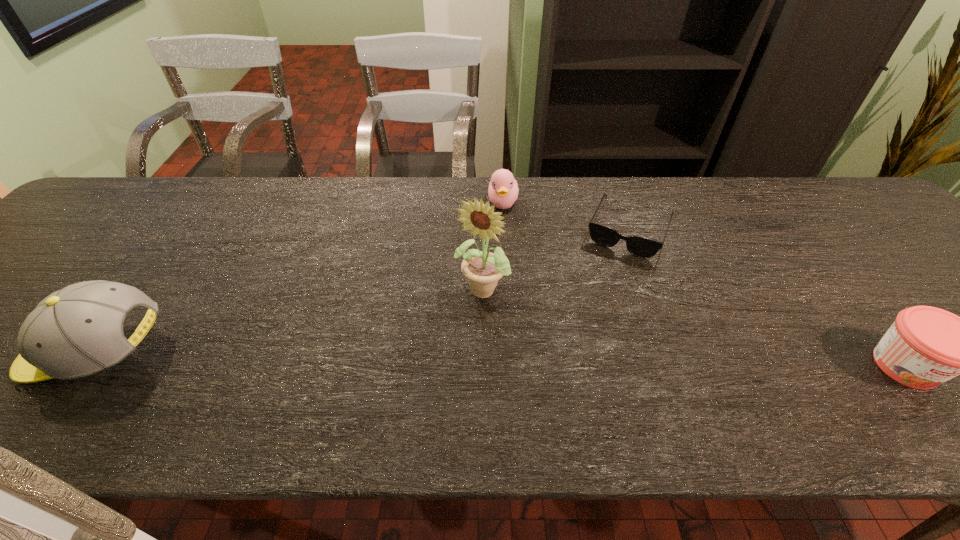
You are a GUI agent. You are given a task and a screenshot of the screen. Output one action in this format:
    pyautogui.click(x=<x>, y=<y>)
    Task: Click on the vacant space on the desktop that is between the baseball cap and the rightmost object and is positioned on the front-facing side of the duckling
    The height and width of the screenshot is (540, 960).
    Given the screenshot: What is the action you would take?
    (517, 360)

Where is `free space on the desktop that is between the baseball cap and the rightmost object and is positioned at the front lenses of the sunglasses`? Image resolution: width=960 pixels, height=540 pixels. free space on the desktop that is between the baseball cap and the rightmost object and is positioned at the front lenses of the sunglasses is located at coordinates (574, 361).

The width and height of the screenshot is (960, 540). Identify the location of free space on the desktop that is between the fourth shortest object and the jam and is positioned on the front-facing side of the third farthest object. (440, 359).